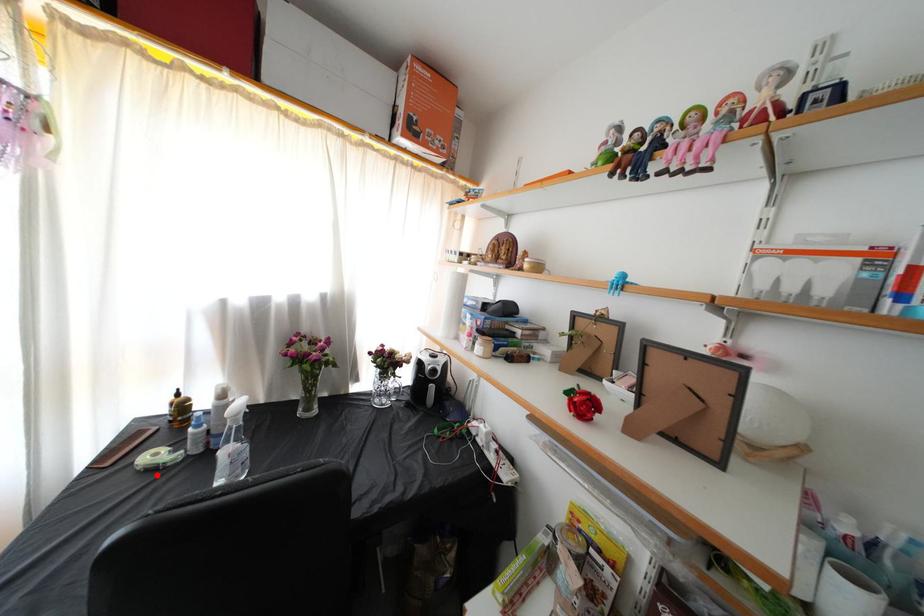
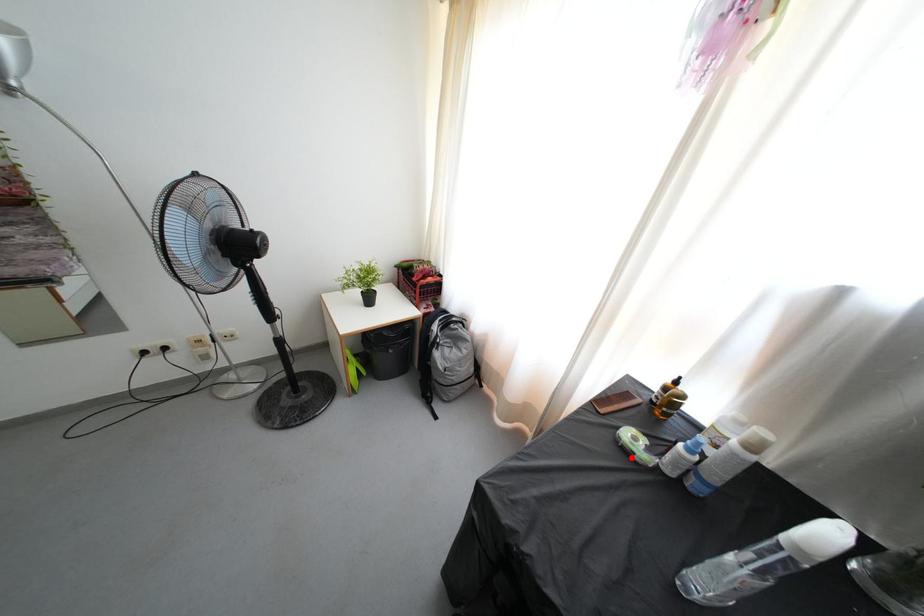
I am providing you with two images of the same scene from different viewpoints. A red point is marked on the first image and another point is marked on the second image. Are the points marked in image1 and image2 representing the same 3D position?

Yes